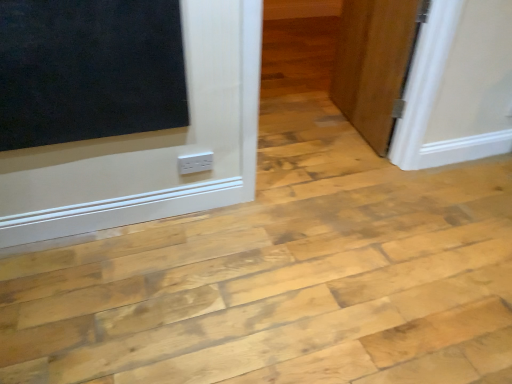
Identify the location of free space in front of wooden door at right. (325, 149).